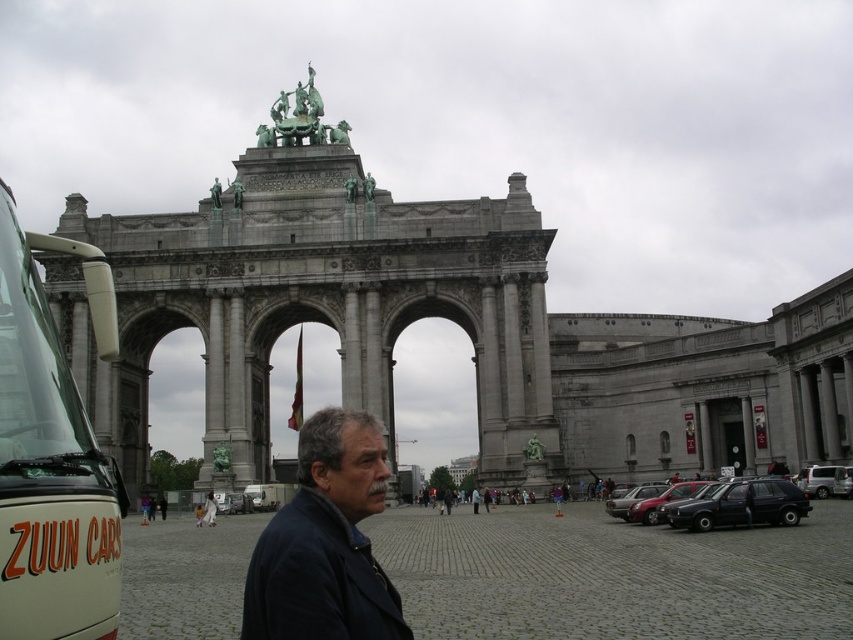
Question: Is white matte bus at left above dark blue jacket at center?

Choices:
 (A) yes
 (B) no

Answer: (A)

Question: Does white matte bus at left have a larger size compared to dark blue jacket at center?

Choices:
 (A) no
 (B) yes

Answer: (A)

Question: Among these points, which one is farthest from the camera?

Choices:
 (A) (53, 538)
 (B) (300, 436)

Answer: (B)

Question: In this image, where is white matte bus at left located relative to dark blue jacket at center?

Choices:
 (A) right
 (B) left

Answer: (B)